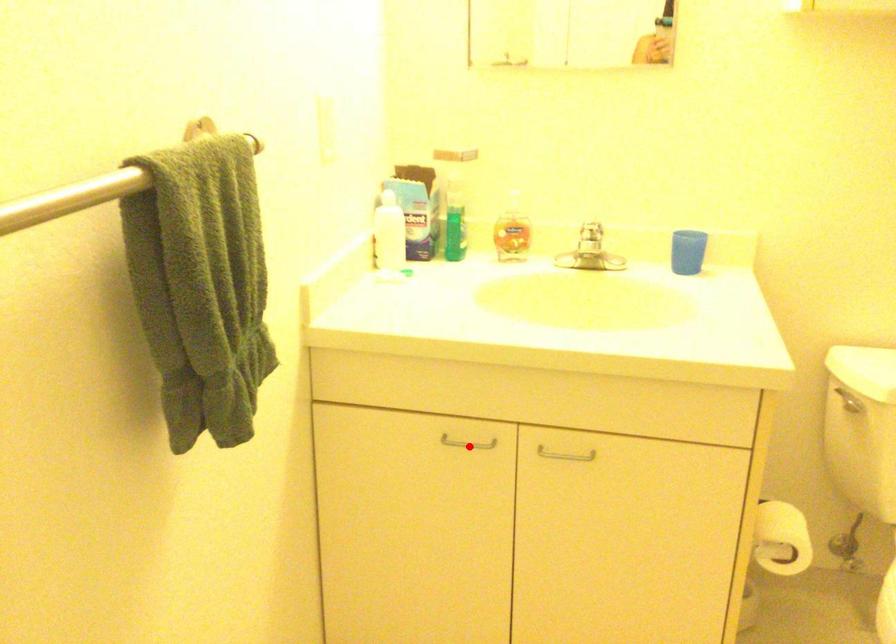
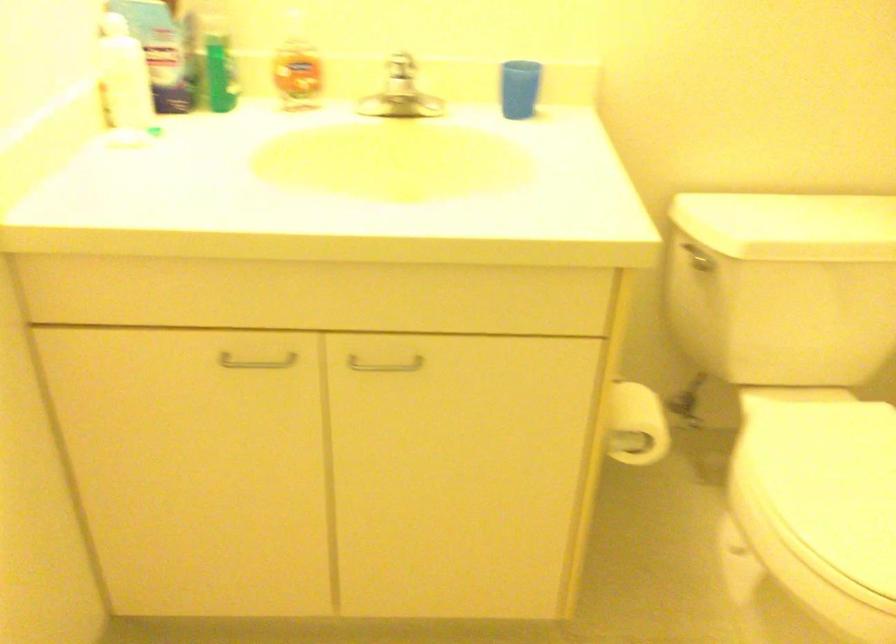
Find the pixel in the second image that matches the highlighted location in the first image.

(256, 362)